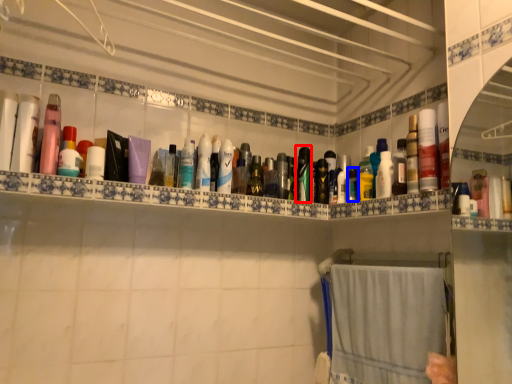
Question: Which of the following is the farthest to the observer, toiletry (highlighted by a red box) or toiletry (highlighted by a blue box)?

Choices:
 (A) toiletry
 (B) toiletry

Answer: (A)